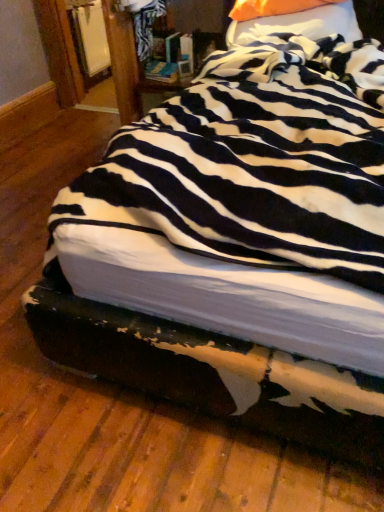
Question: In which direction should I rotate to look at orange fabric pillow at upper center, arranged as the second pillow when viewed from the top?

Choices:
 (A) right
 (B) left

Answer: (A)

Question: Are orange fabric pillow at upper center, which is the 1th pillow in bottom-to-top order, and orange fabric pillow at upper center, which is the first pillow in top-to-bottom order, located far from each other?

Choices:
 (A) no
 (B) yes

Answer: (A)

Question: Are orange fabric pillow at upper center, arranged as the second pillow when viewed from the top, and orange fabric pillow at upper center, which is the first pillow in top-to-bottom order, beside each other?

Choices:
 (A) yes
 (B) no

Answer: (A)

Question: Considering the relative positions of orange fabric pillow at upper center, which is the 1th pillow in bottom-to-top order, and orange fabric pillow at upper center, which is the first pillow in top-to-bottom order, in the image provided, is orange fabric pillow at upper center, which is the 1th pillow in bottom-to-top order, behind orange fabric pillow at upper center, which is the first pillow in top-to-bottom order,?

Choices:
 (A) no
 (B) yes

Answer: (A)

Question: From the image's perspective, is orange fabric pillow at upper center, which is the 1th pillow in bottom-to-top order, beneath orange fabric pillow at upper center, acting as the 2th pillow starting from the bottom?

Choices:
 (A) yes
 (B) no

Answer: (A)

Question: From a real-world perspective, is orange fabric pillow at upper center, which is the 1th pillow in bottom-to-top order, located beneath orange fabric pillow at upper center, which is the first pillow in top-to-bottom order?

Choices:
 (A) yes
 (B) no

Answer: (A)

Question: Can you confirm if orange fabric pillow at upper center, which is the 1th pillow in bottom-to-top order, is positioned to the right of orange fabric pillow at upper center, which is the first pillow in top-to-bottom order?

Choices:
 (A) no
 (B) yes

Answer: (A)

Question: Is orange fabric pillow at upper center, acting as the 2th pillow starting from the bottom, located outside orange fabric pillow at upper center, arranged as the second pillow when viewed from the top?

Choices:
 (A) no
 (B) yes

Answer: (A)

Question: Is orange fabric pillow at upper center, which is the first pillow in top-to-bottom order, facing away from orange fabric pillow at upper center, which is the 1th pillow in bottom-to-top order?

Choices:
 (A) no
 (B) yes

Answer: (B)

Question: Is orange fabric pillow at upper center, acting as the 2th pillow starting from the bottom, smaller than orange fabric pillow at upper center, which is the 1th pillow in bottom-to-top order?

Choices:
 (A) no
 (B) yes

Answer: (B)

Question: Is orange fabric pillow at upper center, which is the 1th pillow in bottom-to-top order, completely or partially inside orange fabric pillow at upper center, which is the first pillow in top-to-bottom order?

Choices:
 (A) yes
 (B) no

Answer: (B)

Question: Does orange fabric pillow at upper center, which is the first pillow in top-to-bottom order, have a lesser width compared to orange fabric pillow at upper center, which is the 1th pillow in bottom-to-top order?

Choices:
 (A) no
 (B) yes

Answer: (B)

Question: Considering the relative sizes of orange fabric pillow at upper center, acting as the 2th pillow starting from the bottom, and orange fabric pillow at upper center, which is the 1th pillow in bottom-to-top order, in the image provided, is orange fabric pillow at upper center, acting as the 2th pillow starting from the bottom, bigger than orange fabric pillow at upper center, which is the 1th pillow in bottom-to-top order,?

Choices:
 (A) yes
 (B) no

Answer: (B)

Question: Is orange fabric pillow at upper center, which is the first pillow in top-to-bottom order, taller or shorter than orange fabric pillow at upper center, which is the 1th pillow in bottom-to-top order?

Choices:
 (A) tall
 (B) short

Answer: (B)